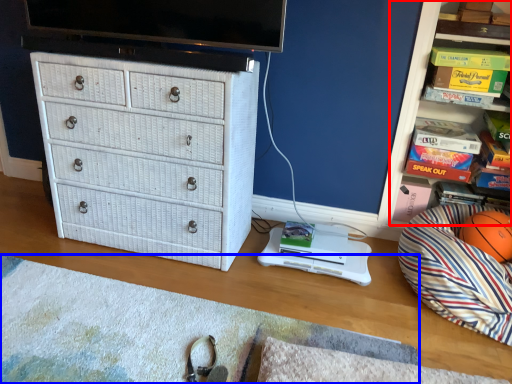
Question: Which of the following is the closest to the observer, shelf (highlighted by a red box) or mat (highlighted by a blue box)?

Choices:
 (A) shelf
 (B) mat

Answer: (B)